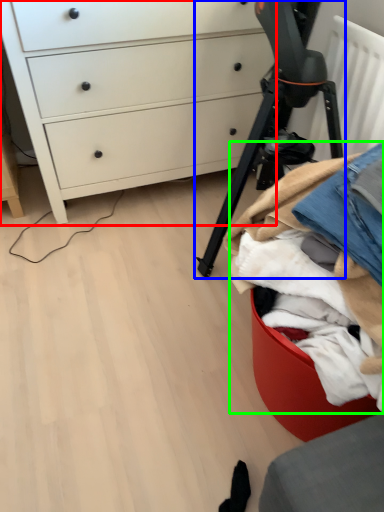
Question: Considering the real-world distances, which object is closest to chest of drawers (highlighted by a red box)? tripod (highlighted by a blue box) or clothing (highlighted by a green box).

Choices:
 (A) tripod
 (B) clothing

Answer: (A)